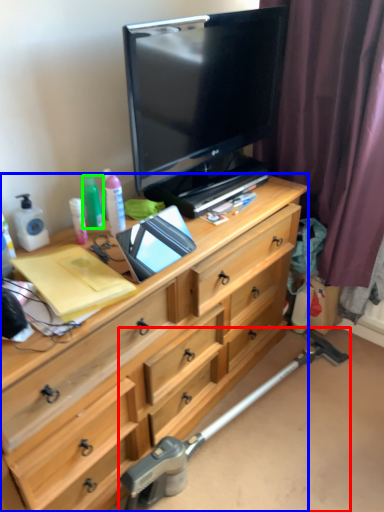
Question: Considering the real-world distances, which object is farthest from crutch (highlighted by a red box)? chest of drawers (highlighted by a blue box) or bottle (highlighted by a green box)?

Choices:
 (A) chest of drawers
 (B) bottle

Answer: (B)